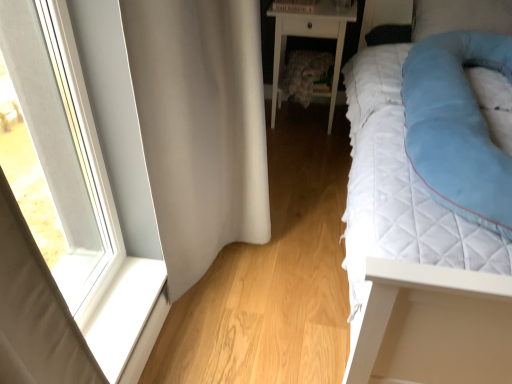
Find the location of `free point in front of white glossy nightstand at center`. free point in front of white glossy nightstand at center is located at coordinates (308, 147).